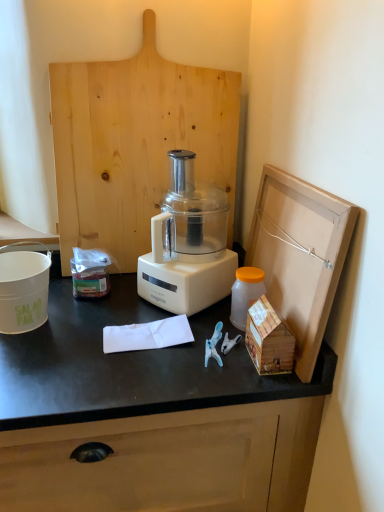
Question: Would you consider white matte salad pail at left to be distant from translucent plastic bottle at right?

Choices:
 (A) no
 (B) yes

Answer: (A)

Question: Does white matte salad pail at left lie in front of translucent plastic bottle at right?

Choices:
 (A) yes
 (B) no

Answer: (A)

Question: Can you confirm if white matte salad pail at left is positioned to the left of translucent plastic bottle at right?

Choices:
 (A) no
 (B) yes

Answer: (B)

Question: Could you tell me if white matte salad pail at left is facing translucent plastic bottle at right?

Choices:
 (A) no
 (B) yes

Answer: (A)

Question: Is white matte salad pail at left to the right of translucent plastic bottle at right from the viewer's perspective?

Choices:
 (A) no
 (B) yes

Answer: (A)

Question: Considering their positions, is white matte salad pail at left located in front of or behind wooden house at right, marked as the 2th wood in a back-to-front arrangement?

Choices:
 (A) front
 (B) behind

Answer: (B)

Question: Considering the positions of white matte salad pail at left and wooden house at right, which is the 1th wood in bottom-to-top order, in the image, is white matte salad pail at left taller or shorter than wooden house at right, which is the 1th wood in bottom-to-top order,?

Choices:
 (A) short
 (B) tall

Answer: (B)

Question: Would you say white matte salad pail at left is to the left or to the right of wooden house at right, which is the 1th wood in bottom-to-top order, in the picture?

Choices:
 (A) left
 (B) right

Answer: (A)

Question: From a real-world perspective, is white matte salad pail at left above or below wooden house at right, the 1th wood in the front-to-back sequence?

Choices:
 (A) above
 (B) below

Answer: (A)

Question: Would you say natural wood cutting board at center, the 2th wood when ordered from front to back, is inside or outside white plastic blender at center?

Choices:
 (A) outside
 (B) inside

Answer: (A)

Question: Relative to white plastic blender at center, is natural wood cutting board at center, the 2th wood in the right-to-left sequence, in front or behind?

Choices:
 (A) front
 (B) behind

Answer: (B)

Question: Based on their positions, is natural wood cutting board at center, the 2th wood when ordered from front to back, located to the left or right of white plastic blender at center?

Choices:
 (A) left
 (B) right

Answer: (A)

Question: Is natural wood cutting board at center, acting as the 1th wood starting from the top, taller or shorter than white plastic blender at center?

Choices:
 (A) short
 (B) tall

Answer: (B)

Question: In terms of width, does natural wood cutting board at center, which is counted as the 1th wood, starting from the back, look wider or thinner when compared to white matte salad pail at left?

Choices:
 (A) thin
 (B) wide

Answer: (A)

Question: In terms of size, does natural wood cutting board at center, acting as the 2th wood starting from the bottom, appear bigger or smaller than white matte salad pail at left?

Choices:
 (A) big
 (B) small

Answer: (A)